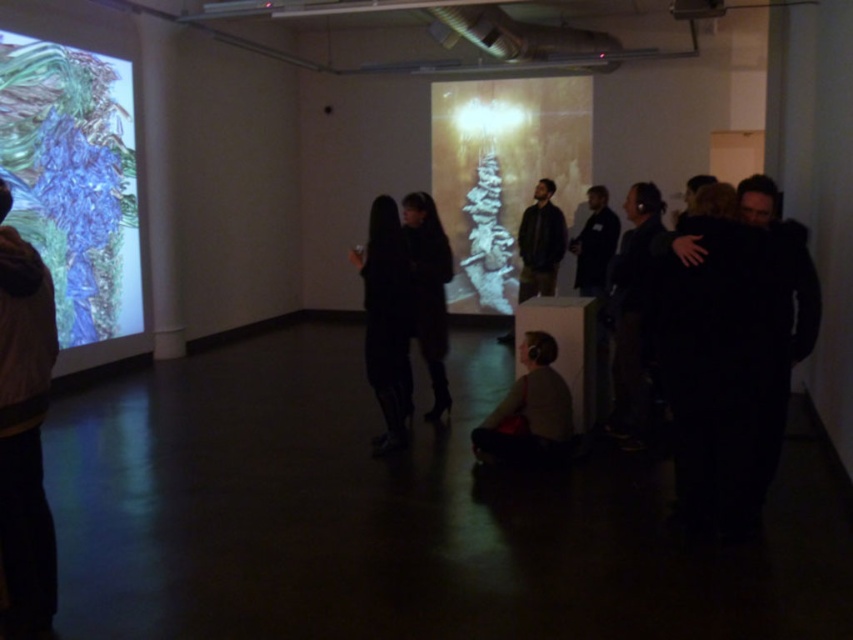
Does white sweater at left have a greater height compared to dark hair at right?

In fact, white sweater at left may be shorter than dark hair at right.

Does point (44, 390) come farther from viewer compared to point (633, 392)?

No, (44, 390) is in front of (633, 392).

Measure the distance between white sweater at left and camera.

white sweater at left and camera are 2.27 meters apart.

Where is `white sweater at left`? white sweater at left is located at coordinates (24, 429).

From the picture: Does dark gray sweater at lower center lie behind black leather boots at center?

No.

Who is positioned more to the right, dark gray sweater at lower center or black leather boots at center?

dark gray sweater at lower center is more to the right.

Who is more forward, [550,436] or [440,385]?

Point [550,436]

I want to click on dark gray sweater at lower center, so click(529, 412).

Is black leather boots at center below dark blue jacket at center?

Correct, black leather boots at center is located below dark blue jacket at center.

Who is more distant from viewer, (427, 196) or (596, 195)?

The point (596, 195) is behind.

Is point (412, 268) farther from viewer compared to point (585, 266)?

No, it is not.

Where is `black leather boots at center`? The image size is (853, 640). black leather boots at center is located at coordinates (428, 289).